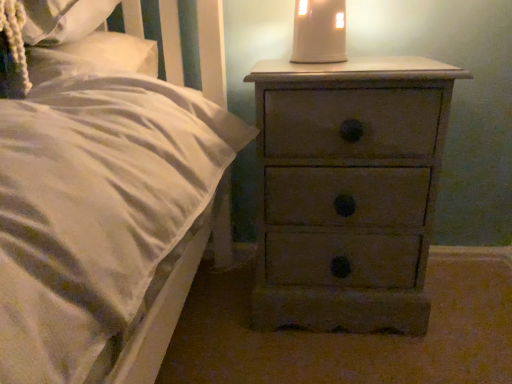
I want to click on matte beige lampshade at upper center, so click(x=319, y=31).

This screenshot has width=512, height=384. What do you see at coordinates (319, 31) in the screenshot?
I see `matte beige lampshade at upper center` at bounding box center [319, 31].

The width and height of the screenshot is (512, 384). What are the coordinates of `distressed wood chest of drawers at right` in the screenshot? It's located at (347, 191).

What do you see at coordinates (347, 191) in the screenshot? The image size is (512, 384). I see `distressed wood chest of drawers at right` at bounding box center [347, 191].

Image resolution: width=512 pixels, height=384 pixels. Identify the location of matte beige lampshade at upper center. (319, 31).

Is distressed wood chest of drawers at right to the left of matte beige lampshade at upper center from the viewer's perspective?

No, distressed wood chest of drawers at right is not to the left of matte beige lampshade at upper center.

Consider the image. Considering the positions of objects distressed wood chest of drawers at right and matte beige lampshade at upper center in the image provided, who is in front, distressed wood chest of drawers at right or matte beige lampshade at upper center?

Positioned in front is distressed wood chest of drawers at right.

Does point (364, 117) lie behind point (305, 22)?

No, it is not.

From the image's perspective, is distressed wood chest of drawers at right above or below matte beige lampshade at upper center?

From the image's perspective, distressed wood chest of drawers at right appears below matte beige lampshade at upper center.

From a real-world perspective, is distressed wood chest of drawers at right physically above matte beige lampshade at upper center?

Incorrect, from a real-world perspective, distressed wood chest of drawers at right is lower than matte beige lampshade at upper center.

Considering the relative sizes of distressed wood chest of drawers at right and matte beige lampshade at upper center in the image provided, is distressed wood chest of drawers at right thinner than matte beige lampshade at upper center?

Incorrect, the width of distressed wood chest of drawers at right is not less than that of matte beige lampshade at upper center.

Considering the relative sizes of distressed wood chest of drawers at right and matte beige lampshade at upper center in the image provided, is distressed wood chest of drawers at right taller than matte beige lampshade at upper center?

Indeed, distressed wood chest of drawers at right has a greater height compared to matte beige lampshade at upper center.

Looking at this image, does distressed wood chest of drawers at right have a smaller size compared to matte beige lampshade at upper center?

Incorrect, distressed wood chest of drawers at right is not smaller in size than matte beige lampshade at upper center.

Is distressed wood chest of drawers at right outside of matte beige lampshade at upper center?

Absolutely, distressed wood chest of drawers at right is external to matte beige lampshade at upper center.

Is distressed wood chest of drawers at right next to matte beige lampshade at upper center?

No, distressed wood chest of drawers at right is not making contact with matte beige lampshade at upper center.

Is distressed wood chest of drawers at right facing towards matte beige lampshade at upper center?

No, distressed wood chest of drawers at right is not facing towards matte beige lampshade at upper center.

Based on the photo, could you measure the distance between distressed wood chest of drawers at right and matte beige lampshade at upper center?

distressed wood chest of drawers at right and matte beige lampshade at upper center are 33.96 centimeters apart.

This screenshot has width=512, height=384. I want to click on chest of drawers in front of the matte beige lampshade at upper center, so click(x=347, y=191).

Based on their positions, is matte beige lampshade at upper center located to the left or right of distressed wood chest of drawers at right?

In the image, matte beige lampshade at upper center appears on the left side of distressed wood chest of drawers at right.

Which is behind, matte beige lampshade at upper center or distressed wood chest of drawers at right?

matte beige lampshade at upper center.

Which is closer, [333,40] or [413,307]?

Point [333,40] is closer to the camera than point [413,307].

From the image's perspective, which is above, matte beige lampshade at upper center or distressed wood chest of drawers at right?

matte beige lampshade at upper center is shown above in the image.

From a real-world perspective, between matte beige lampshade at upper center and distressed wood chest of drawers at right, who is vertically higher?

matte beige lampshade at upper center, from a real-world perspective.

Is matte beige lampshade at upper center thinner than distressed wood chest of drawers at right?

Yes, matte beige lampshade at upper center is thinner than distressed wood chest of drawers at right.

Considering the sizes of objects matte beige lampshade at upper center and distressed wood chest of drawers at right in the image provided, who is shorter, matte beige lampshade at upper center or distressed wood chest of drawers at right?

Standing shorter between the two is matte beige lampshade at upper center.

Between matte beige lampshade at upper center and distressed wood chest of drawers at right, which one has smaller size?

Smaller between the two is matte beige lampshade at upper center.

Is distressed wood chest of drawers at right completely or partially inside matte beige lampshade at upper center?

No, distressed wood chest of drawers at right is not a part of matte beige lampshade at upper center.

Does matte beige lampshade at upper center touch distressed wood chest of drawers at right?

No.

Is matte beige lampshade at upper center facing away from distressed wood chest of drawers at right?

No.

Locate an element on the screen. The height and width of the screenshot is (384, 512). bedside lamp above the distressed wood chest of drawers at right (from a real-world perspective) is located at coordinates (319, 31).

Where is `bedside lamp above the distressed wood chest of drawers at right (from the image's perspective)`? This screenshot has width=512, height=384. bedside lamp above the distressed wood chest of drawers at right (from the image's perspective) is located at coordinates (319, 31).

Identify the location of the chest of drawers directly beneath the matte beige lampshade at upper center (from a real-world perspective). The height and width of the screenshot is (384, 512). (347, 191).